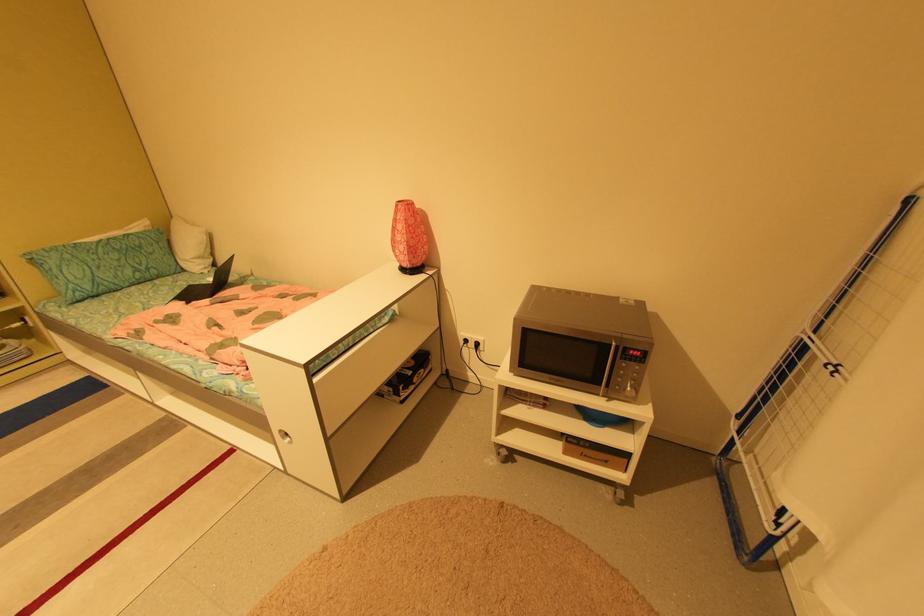
Describe the element at coordinates (608, 369) in the screenshot. I see `a silver microwave handle` at that location.